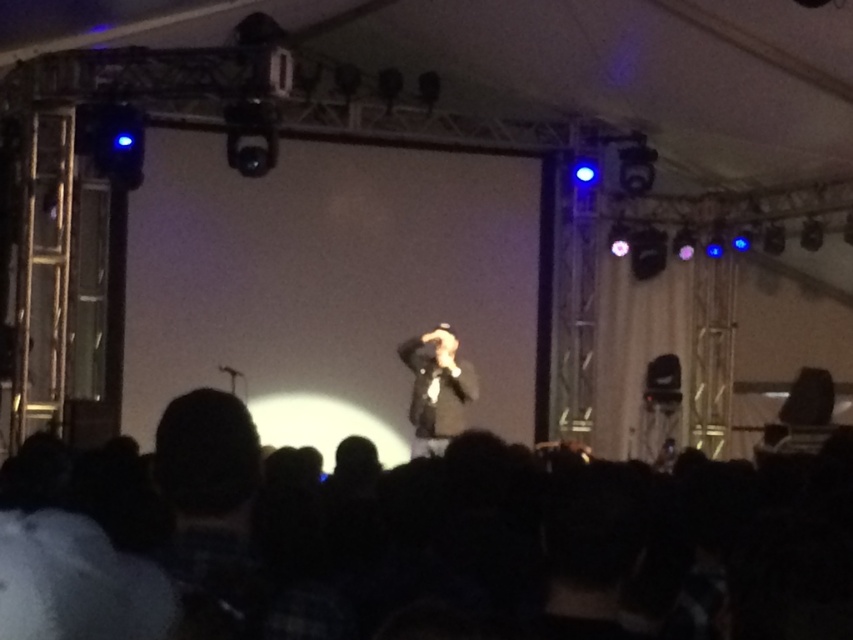
Based on the photo, does black fabric at lower center have a lesser width compared to dark suit at center?

No.

Is point (108, 497) farther from camera compared to point (473, 392)?

No.

You are a GUI agent. You are given a task and a screenshot of the screen. Output one action in this format:
    pyautogui.click(x=<x>, y=<y>)
    Task: Click on the black fabric at lower center
    The height and width of the screenshot is (640, 853).
    Given the screenshot: What is the action you would take?
    pyautogui.click(x=492, y=538)

Identify the location of black fabric at lower center. (492, 538).